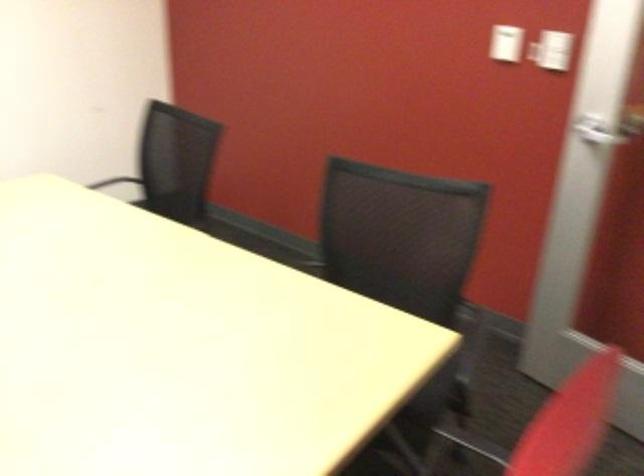
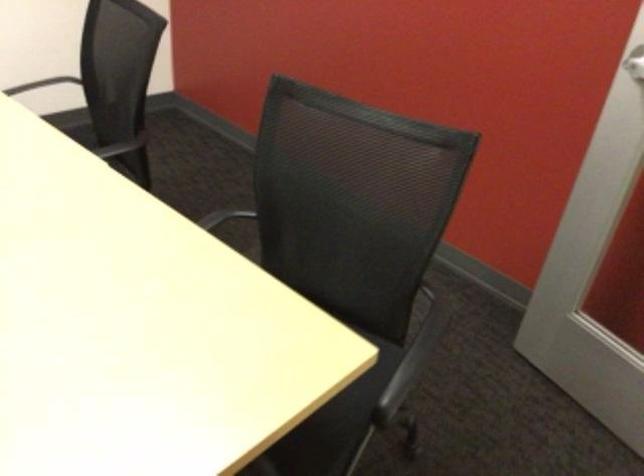
Question: The images are taken continuously from a first-person perspective. In which direction is your viewpoint rotating?

Choices:
 (A) Left
 (B) Right
 (C) Up
 (D) Down

Answer: (D)